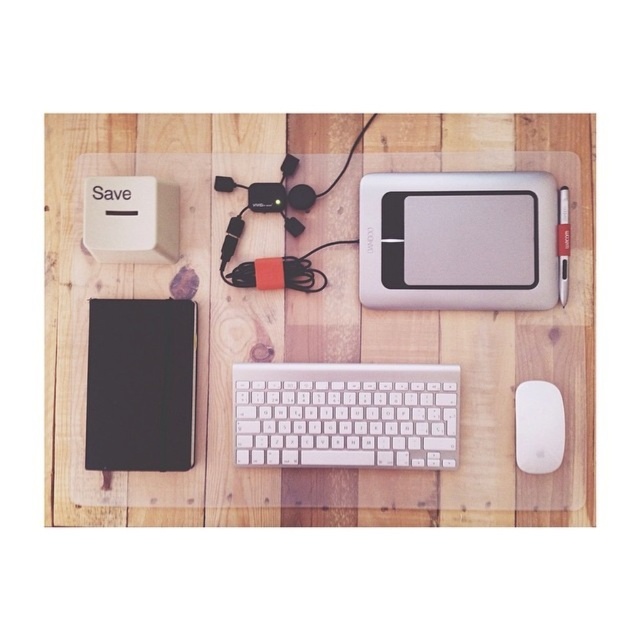
You are trying to organize the desk and need to place a new item between the two points on the cable. Which point should you place it closer to in order to keep the cable from being too tight? Please choose between point A at (352, 401) and point B at (106, 356).

You should place the new item closer to point B at (106, 356) because point A at (352, 401) is behind point B, so placing it near B would allow the cable to have more slack.

Please provide the 2D coordinates of the silver metallic drawing tablet at center in the workspace setup.

The silver metallic drawing tablet at center is located at the coordinates point (458, 241).

You are an artist working on a project and need to place a rectangular object that is 12 inches wide on the desk. You have a silver metallic drawing tablet at center and a white plastic keyboard at center available. Which object can accommodate the width of the rectangular object?

The white plastic keyboard at center has a greater width than the silver metallic drawing tablet at center. Since the rectangular object is 12 inches wide, you should check the width of the white plastic keyboard at center to see if it can accommodate the object. However, the description only states that the drawing tablet is narrower, so the keyboard might be suitable if its width meets or exceeds 12 inches.